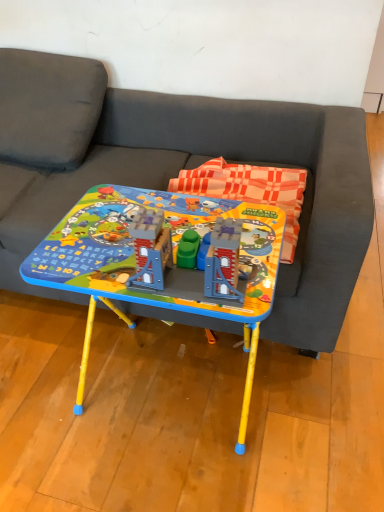
Identify the location of free space to the left of matte plastic table at center. (43, 383).